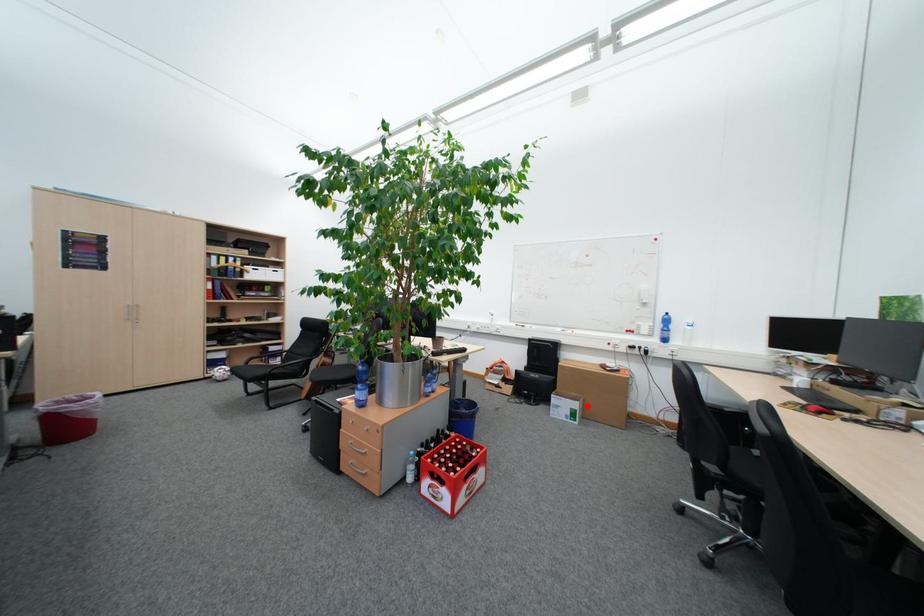
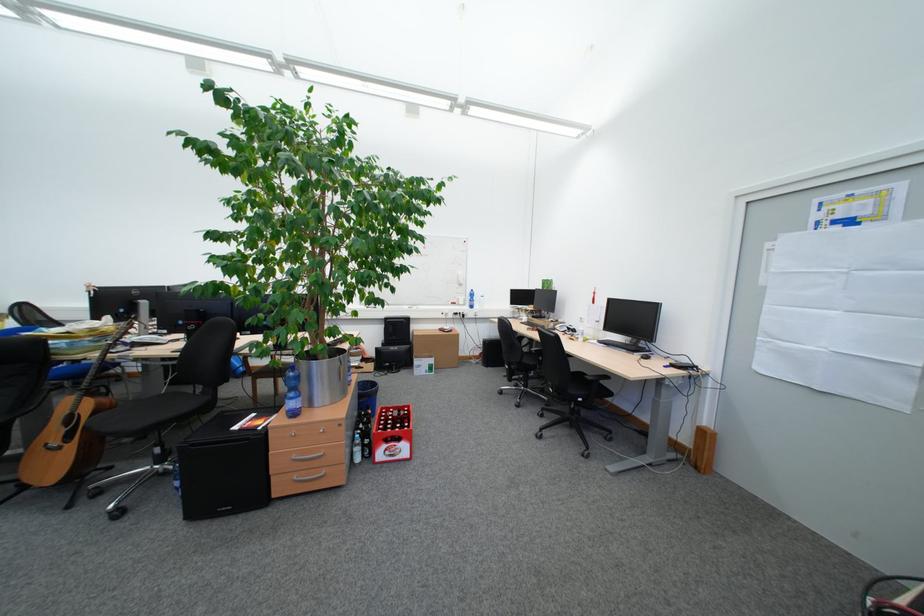
Question: I am providing you with two images of the same scene from different viewpoints. In image1, a red point is highlighted. Considering the same 3D point in image2, which of the following is correct?

Choices:
 (A) It is closer
 (B) It is farther

Answer: (B)